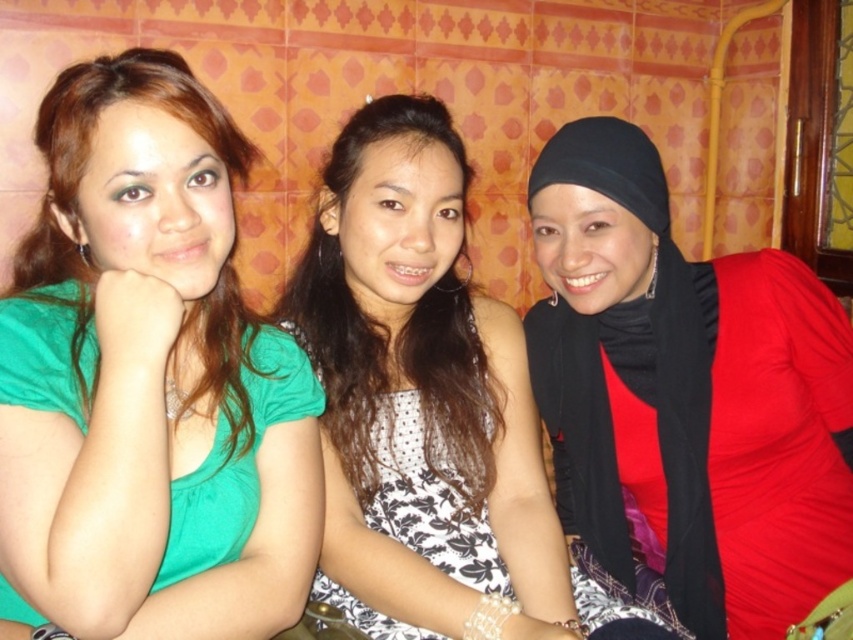
Question: Which object is the farthest from the green matte shirt at left?

Choices:
 (A) black matte hijab at right
 (B) polka dot fabric dress at center
 (C) white dotted dress at center

Answer: (A)

Question: Which point is farther from the camera taking this photo?

Choices:
 (A) (376, 132)
 (B) (407, 506)
 (C) (664, 305)

Answer: (C)

Question: Observing the image, what is the correct spatial positioning of black matte hijab at right in reference to white dotted dress at center?

Choices:
 (A) right
 (B) left

Answer: (A)

Question: Which point appears farthest from the camera in this image?

Choices:
 (A) (509, 387)
 (B) (186, 96)

Answer: (A)

Question: Is white dotted dress at center closer to the viewer compared to polka dot fabric dress at center?

Choices:
 (A) yes
 (B) no

Answer: (A)

Question: Can you confirm if white dotted dress at center is bigger than polka dot fabric dress at center?

Choices:
 (A) yes
 (B) no

Answer: (A)